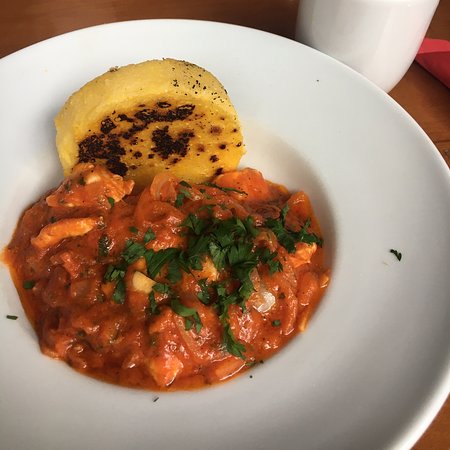
At what (x,y) coordinates should I click in order to perform the action: click on white cup. Please return your answer as a coordinate pair (x, y). Image resolution: width=450 pixels, height=450 pixels. Looking at the image, I should click on tap(353, 61).